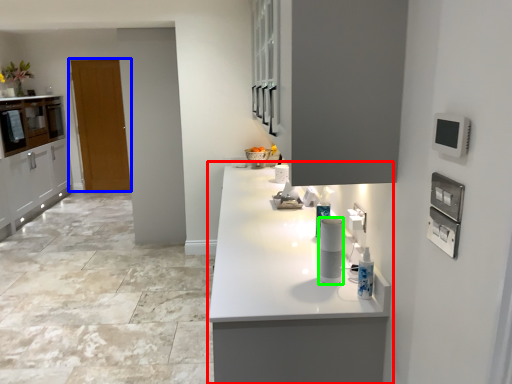
Question: Estimate the real-world distances between objects in this image. Which object is closer to countertop (highlighted by a red box), door (highlighted by a blue box) or appliance (highlighted by a green box)?

Choices:
 (A) door
 (B) appliance

Answer: (B)